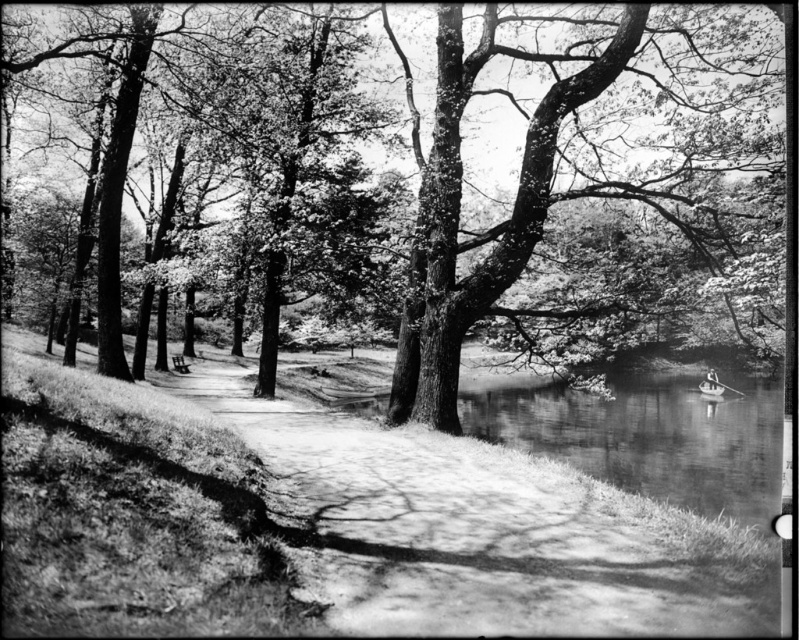
Question: Which point is farther to the camera?

Choices:
 (A) (668, 33)
 (B) (543, 600)
 (C) (177, 364)

Answer: (C)

Question: Is smooth bark tree at center smaller than smooth dirt path at center?

Choices:
 (A) yes
 (B) no

Answer: (B)

Question: Which object is positioned closest to the smooth bark tree at center?

Choices:
 (A) smooth dirt path at center
 (B) wooden park bench at center

Answer: (A)

Question: Which of the following is the farthest from the observer?

Choices:
 (A) wooden park bench at center
 (B) smooth bark tree at center

Answer: (A)

Question: Is smooth dirt path at center positioned at the back of wooden park bench at center?

Choices:
 (A) no
 (B) yes

Answer: (A)

Question: Observing the image, what is the correct spatial positioning of smooth bark tree at center in reference to smooth water at lower right?

Choices:
 (A) below
 (B) above

Answer: (B)